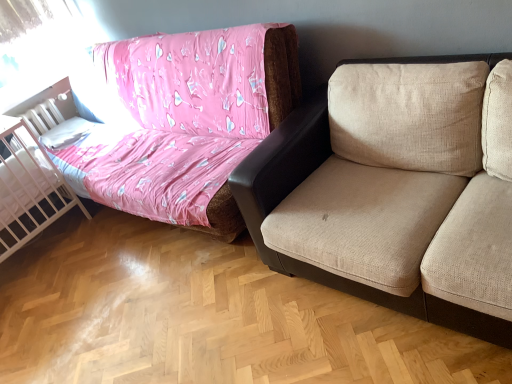
Locate an element on the screen. This screenshot has width=512, height=384. vacant space that's between white mesh crib at left and beige fabric studio couch at upper right is located at coordinates (97, 260).